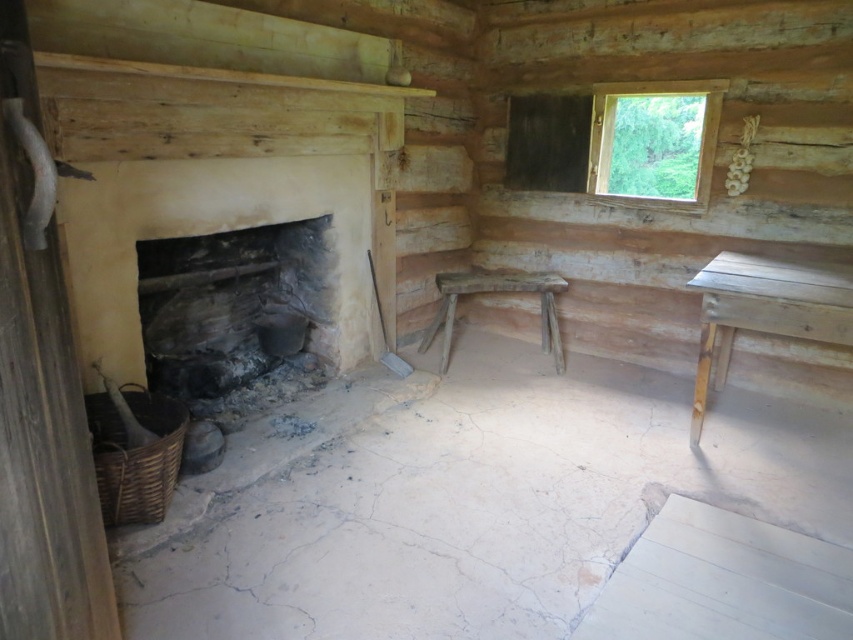
You are a delivery person trying to place a package that is 1 meter long. You see the transparent wooden window at upper right and the rustic wooden stool at center. Can you fit the package horizontally between them?

The transparent wooden window at upper right and rustic wooden stool at center are 97.99 centimeters apart. Since the package is 1 meter long, which is longer than the distance between them, you cannot fit the package horizontally between them.

You are standing in the center of the log cabin and want to place a new rug. The rug needs to be placed exactly at the point specified by the coordinates point (764, 310). What object is located at that point?

The point (764, 310) corresponds to the wooden table at right, so the rug should be placed there.